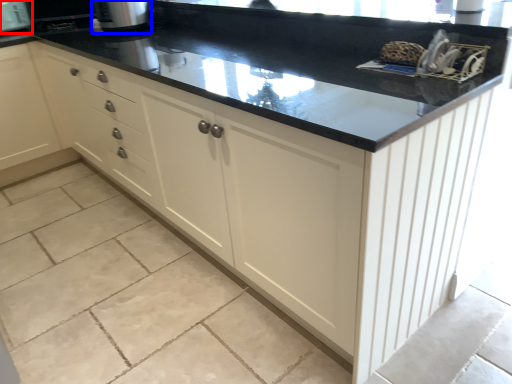
Question: Which point is further to the camera, appliance (highlighted by a red box) or appliance (highlighted by a blue box)?

Choices:
 (A) appliance
 (B) appliance

Answer: (A)